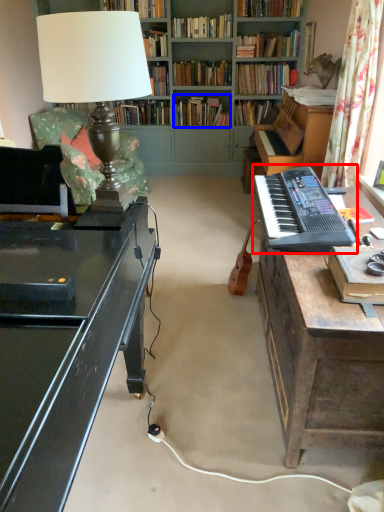
Question: Which of the following is the farthest to the observer, musical keyboard (highlighted by a red box) or book (highlighted by a blue box)?

Choices:
 (A) musical keyboard
 (B) book

Answer: (B)